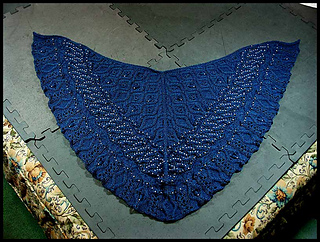
Where is `lace`? This screenshot has height=242, width=320. lace is located at coordinates (164, 120).